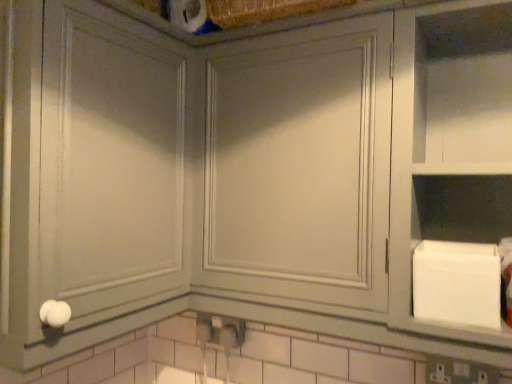
Where is `matte gray cabinet at center, the 1th glass door from the left`? This screenshot has height=384, width=512. matte gray cabinet at center, the 1th glass door from the left is located at coordinates (111, 160).

Find the location of a particular element. The image size is (512, 384). matte gray cabinet at center, the first glass door when ordered from right to left is located at coordinates (298, 165).

What do you see at coordinates (449, 143) in the screenshot? I see `white matte cabinet at right` at bounding box center [449, 143].

This screenshot has height=384, width=512. In order to click on matte gray cabinet at center, the 2th glass door when ordered from right to left in this screenshot , I will do `click(111, 160)`.

Which is nearer, (298, 282) or (147, 196)?

Point (298, 282)

From a real-world perspective, is matte gray cabinet at center, which appears as the 2th glass door when viewed from the left, physically above matte gray cabinet at center, the 2th glass door when ordered from right to left?

Yes, from a real-world perspective, matte gray cabinet at center, which appears as the 2th glass door when viewed from the left, is above matte gray cabinet at center, the 2th glass door when ordered from right to left.

Is the depth of white matte cabinet at right less than that of matte gray cabinet at center, the 2th glass door when ordered from right to left?

No, white matte cabinet at right is behind matte gray cabinet at center, the 2th glass door when ordered from right to left.

Can you tell me how much white matte cabinet at right and matte gray cabinet at center, the 1th glass door from the left, differ in facing direction?

They differ by 90.2 degrees in their facing directions.

How far apart are white matte cabinet at right and matte gray cabinet at center, the 2th glass door when ordered from right to left?

white matte cabinet at right and matte gray cabinet at center, the 2th glass door when ordered from right to left, are 21.88 inches apart from each other.

Can you confirm if white matte cabinet at right is smaller than matte gray cabinet at center, the 2th glass door when ordered from right to left?

Indeed, white matte cabinet at right has a smaller size compared to matte gray cabinet at center, the 2th glass door when ordered from right to left.

Is matte gray cabinet at center, the first glass door when ordered from right to left, situated inside white matte cabinet at right or outside?

matte gray cabinet at center, the first glass door when ordered from right to left, exists outside the volume of white matte cabinet at right.

Considering the points (251, 135) and (428, 207), which point is in front, point (251, 135) or point (428, 207)?

Point (428, 207)

Between matte gray cabinet at center, the first glass door when ordered from right to left, and white matte cabinet at right, which one has more height?

white matte cabinet at right is taller.

The width and height of the screenshot is (512, 384). I want to click on the 1st glass door counting from the left side of the white matte cabinet at right, so click(298, 165).

Is white matte cabinet at right positioned behind matte gray cabinet at center, the first glass door when ordered from right to left?

No, white matte cabinet at right is closer to the viewer.

Considering the relative sizes of white matte cabinet at right and matte gray cabinet at center, the first glass door when ordered from right to left, in the image provided, is white matte cabinet at right shorter than matte gray cabinet at center, the first glass door when ordered from right to left,?

No.

Is white matte cabinet at right bigger than matte gray cabinet at center, which appears as the 2th glass door when viewed from the left?

Incorrect, white matte cabinet at right is not larger than matte gray cabinet at center, which appears as the 2th glass door when viewed from the left.

Is matte gray cabinet at center, the 1th glass door from the left, looking in the opposite direction of matte gray cabinet at center, which appears as the 2th glass door when viewed from the left?

No, matte gray cabinet at center, the 1th glass door from the left, is not facing the opposite direction of matte gray cabinet at center, which appears as the 2th glass door when viewed from the left.

Is matte gray cabinet at center, the 1th glass door from the left, surrounding matte gray cabinet at center, which appears as the 2th glass door when viewed from the left?

No.

From the picture: What's the angular difference between matte gray cabinet at center, the 2th glass door when ordered from right to left, and matte gray cabinet at center, the first glass door when ordered from right to left,'s facing directions?

There is a 89-degree angle between the facing directions of matte gray cabinet at center, the 2th glass door when ordered from right to left, and matte gray cabinet at center, the first glass door when ordered from right to left.

From the image's perspective, is matte gray cabinet at center, the 2th glass door when ordered from right to left, above matte gray cabinet at center, the first glass door when ordered from right to left?

Yes, from the image's perspective, matte gray cabinet at center, the 2th glass door when ordered from right to left, is above matte gray cabinet at center, the first glass door when ordered from right to left.

Is matte gray cabinet at center, the 1th glass door from the left, further to the viewer compared to white matte cabinet at right?

No, matte gray cabinet at center, the 1th glass door from the left, is closer to the camera.

Can you confirm if matte gray cabinet at center, the 2th glass door when ordered from right to left, is bigger than white matte cabinet at right?

Result: Indeed, matte gray cabinet at center, the 2th glass door when ordered from right to left, has a larger size compared to white matte cabinet at right.

Which is further, (46,83) or (462,168)?

The point (462,168) is behind.

Which object is positioned more to the right, matte gray cabinet at center, the 2th glass door when ordered from right to left, or white matte cabinet at right?

white matte cabinet at right is more to the right.

The image size is (512, 384). In order to click on glass door behind the matte gray cabinet at center, the 1th glass door from the left in this screenshot , I will do `click(298, 165)`.

At what (x,y) coordinates should I click in order to perform the action: click on cabinet lying on the right of matte gray cabinet at center, the 2th glass door when ordered from right to left. Please return your answer as a coordinate pair (x, y). Image resolution: width=512 pixels, height=384 pixels. Looking at the image, I should click on (449, 143).

When comparing their distances from matte gray cabinet at center, the first glass door when ordered from right to left, does white matte cabinet at right or matte gray cabinet at center, the 1th glass door from the left, seem closer?

Among the two, white matte cabinet at right is located nearer to matte gray cabinet at center, the first glass door when ordered from right to left.

When comparing their distances from white matte cabinet at right, does matte gray cabinet at center, the 1th glass door from the left, or matte gray cabinet at center, which appears as the 2th glass door when viewed from the left, seem closer?

The object closer to white matte cabinet at right is matte gray cabinet at center, which appears as the 2th glass door when viewed from the left.

Looking at the image, which one is located further to white matte cabinet at right, matte gray cabinet at center, which appears as the 2th glass door when viewed from the left, or matte gray cabinet at center, the 2th glass door when ordered from right to left?

Based on the image, matte gray cabinet at center, the 2th glass door when ordered from right to left, appears to be further to white matte cabinet at right.

Based on their spatial positions, is white matte cabinet at right or matte gray cabinet at center, which appears as the 2th glass door when viewed from the left, further from matte gray cabinet at center, the 1th glass door from the left?

white matte cabinet at right is positioned further to the anchor matte gray cabinet at center, the 1th glass door from the left.

From the image, which object appears to be nearer to matte gray cabinet at center, the 2th glass door when ordered from right to left, matte gray cabinet at center, which appears as the 2th glass door when viewed from the left, or white matte cabinet at right?

Among the two, matte gray cabinet at center, which appears as the 2th glass door when viewed from the left, is located nearer to matte gray cabinet at center, the 2th glass door when ordered from right to left.

Consider the image. Considering their positions, is matte gray cabinet at center, the 1th glass door from the left, positioned closer to matte gray cabinet at center, which appears as the 2th glass door when viewed from the left, than white matte cabinet at right?

Among the two, white matte cabinet at right is located nearer to matte gray cabinet at center, which appears as the 2th glass door when viewed from the left.

I want to click on glass door between matte gray cabinet at center, the 1th glass door from the left, and white matte cabinet at right, in the horizontal direction, so click(298, 165).